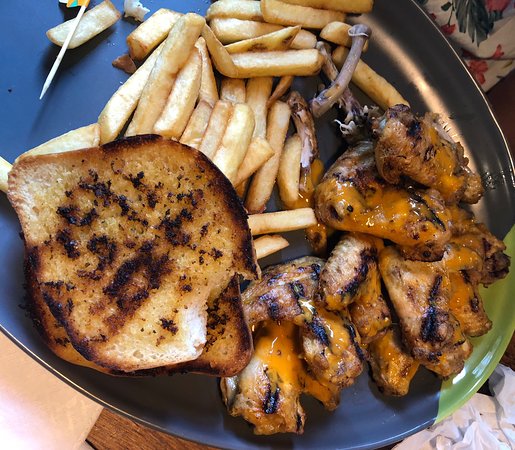
At what (x,y) coordinates should I click in order to perform the action: click on green edge of plate. Please return your answer as a coordinate pair (x, y). Looking at the image, I should click on (488, 348).